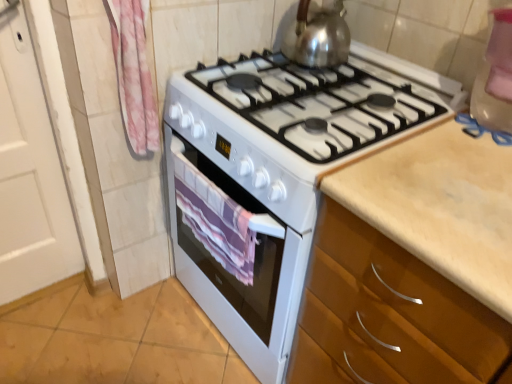
At what (x,y) coordinates should I click in order to perform the action: click on free location to the left of white glossy stove at center. Please return your answer as a coordinate pair (x, y). Image resolution: width=512 pixels, height=384 pixels. Looking at the image, I should click on (112, 332).